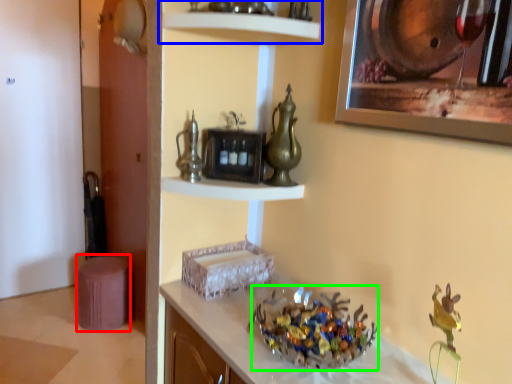
Question: Which is nearer to the stool (highlighted by a red box)? shelf (highlighted by a blue box) or collection (highlighted by a green box).

Choices:
 (A) shelf
 (B) collection

Answer: (B)